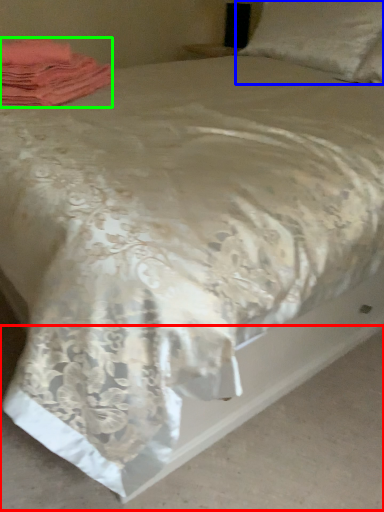
Question: Based on their relative distances, which object is farther from concrete (highlighted by a red box)? Choose from pillow (highlighted by a blue box) and material (highlighted by a green box).

Choices:
 (A) pillow
 (B) material

Answer: (A)